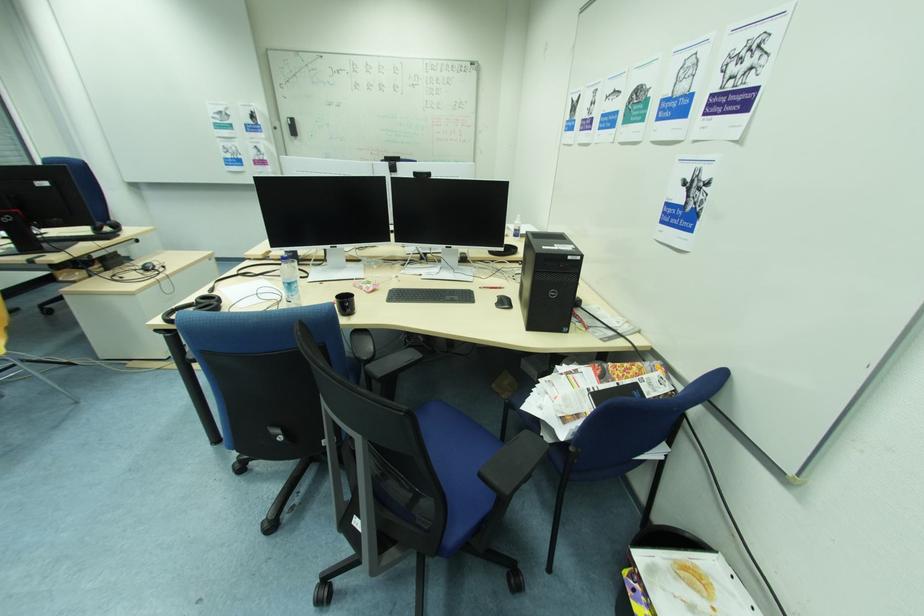
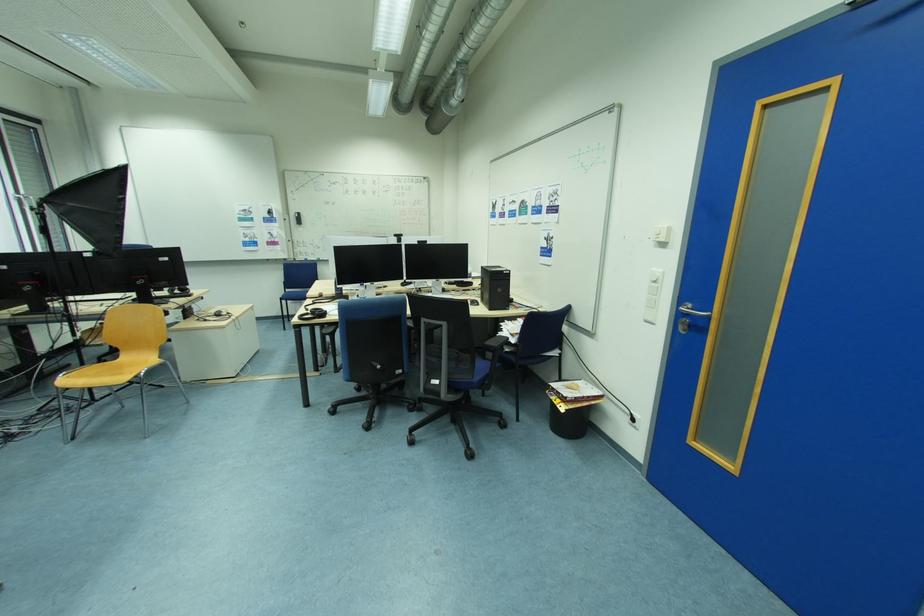
The point at (511, 302) is marked in the first image. Where is the corresponding point in the second image?

(480, 304)